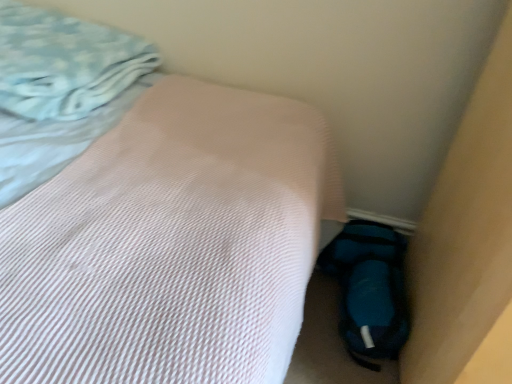
Question: Considering the relative positions of pink textured bed at center and blue fuzzy sleeping bag at lower right in the image provided, is pink textured bed at center to the left or to the right of blue fuzzy sleeping bag at lower right?

Choices:
 (A) right
 (B) left

Answer: (B)

Question: From the image's perspective, is pink textured bed at center positioned above or below blue fuzzy sleeping bag at lower right?

Choices:
 (A) above
 (B) below

Answer: (A)

Question: Which of these objects is positioned closest to the light blue textured blanket at upper left?

Choices:
 (A) blue fuzzy sleeping bag at lower right
 (B) pink textured bed at center

Answer: (B)

Question: Estimate the real-world distances between objects in this image. Which object is closer to the blue fuzzy sleeping bag at lower right?

Choices:
 (A) pink textured bed at center
 (B) light blue textured blanket at upper left

Answer: (A)